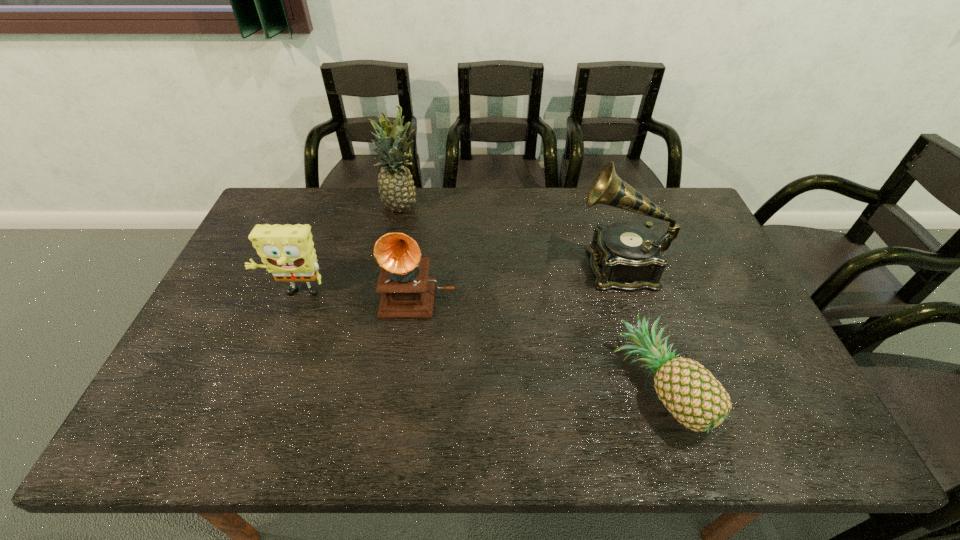
This screenshot has width=960, height=540. I want to click on blank space at the right edge of the desktop, so click(733, 294).

Locate an element on the screen. The width and height of the screenshot is (960, 540). vacant space at the far left corner of the desktop is located at coordinates (300, 218).

Locate an element on the screen. Image resolution: width=960 pixels, height=540 pixels. vacant space at the near left corner of the desktop is located at coordinates (179, 414).

Image resolution: width=960 pixels, height=540 pixels. What are the coordinates of `free location at the far right corner` in the screenshot? It's located at (650, 187).

In order to click on free spot at the near right corner of the desktop in this screenshot , I will do `click(789, 429)`.

Where is `vacant area that lies between the leftmost object and the taller phonograph record`? This screenshot has height=540, width=960. vacant area that lies between the leftmost object and the taller phonograph record is located at coordinates (457, 280).

Find the location of a particular element. The image size is (960, 540). vacant point located between the leftmost object and the shorter phonograph record is located at coordinates click(357, 294).

Where is `free space between the leftmost object and the left phonograph record`? free space between the leftmost object and the left phonograph record is located at coordinates (357, 294).

The height and width of the screenshot is (540, 960). Identify the location of vacant point located between the sponge and the left pineapple. (348, 251).

Locate an element on the screen. The image size is (960, 540). free space between the leftmost object and the left phonograph record is located at coordinates (357, 294).